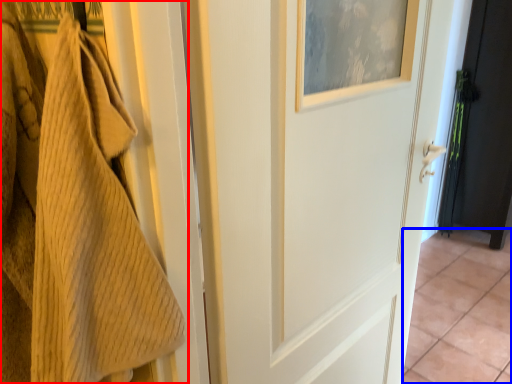
Question: Which object is closer to the camera taking this photo, towel (highlighted by a red box) or tile (highlighted by a blue box)?

Choices:
 (A) towel
 (B) tile

Answer: (A)